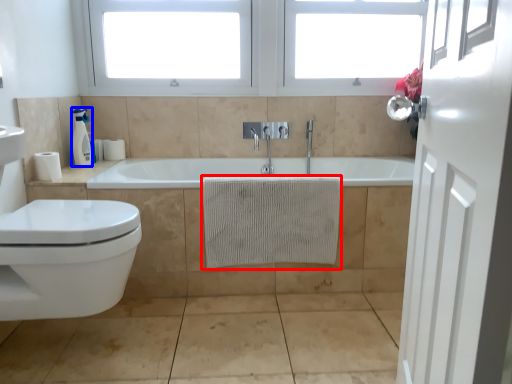
Question: Which of the following is the closest to the observer, bath towel (highlighted by a red box) or soap dispenser (highlighted by a blue box)?

Choices:
 (A) bath towel
 (B) soap dispenser

Answer: (A)